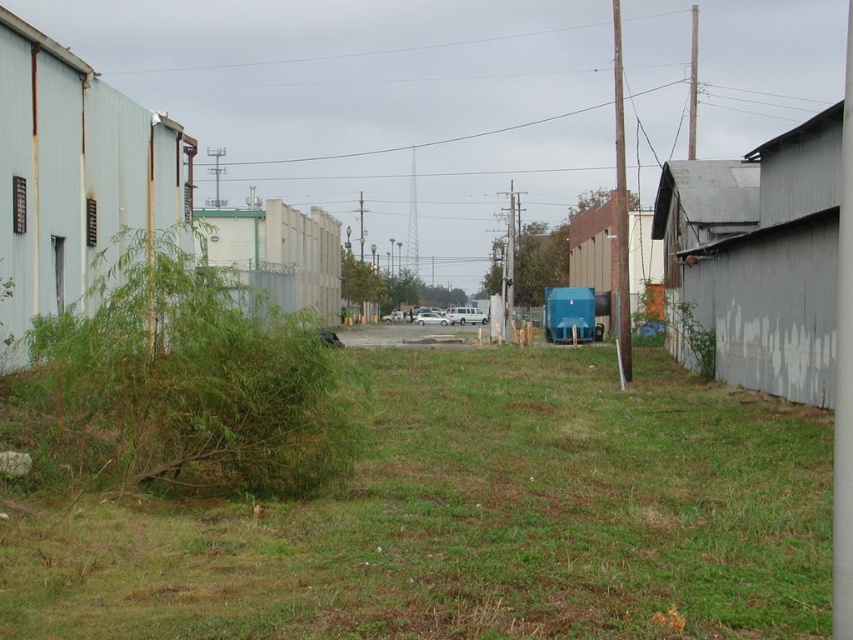
Can you confirm if green grassy at center is positioned below green leafy bush at left?

Indeed, green grassy at center is positioned under green leafy bush at left.

Is green grassy at center bigger than green leafy bush at left?

Indeed, green grassy at center has a larger size compared to green leafy bush at left.

Who is more distant from viewer, (682, 486) or (248, 417)?

The point (682, 486) is more distant.

I want to click on green grassy at center, so 474,520.

Between green grassy at center and white matte van at center, which one has more height?

With more height is green grassy at center.

Does green grassy at center have a lesser width compared to white matte van at center?

Correct, green grassy at center's width is less than white matte van at center's.

Locate an element on the screen. green grassy at center is located at coordinates (474, 520).

Find the location of a particular element. This screenshot has width=853, height=640. green grassy at center is located at coordinates (474, 520).

Is green leafy bush at left to the right of white matte van at center from the viewer's perspective?

Incorrect, green leafy bush at left is not on the right side of white matte van at center.

Can you confirm if green leafy bush at left is shorter than white matte van at center?

In fact, green leafy bush at left may be taller than white matte van at center.

Is point (299, 390) closer to camera compared to point (361, 342)?

Yes, point (299, 390) is in front of point (361, 342).

Locate an element on the screen. green leafy bush at left is located at coordinates (189, 385).